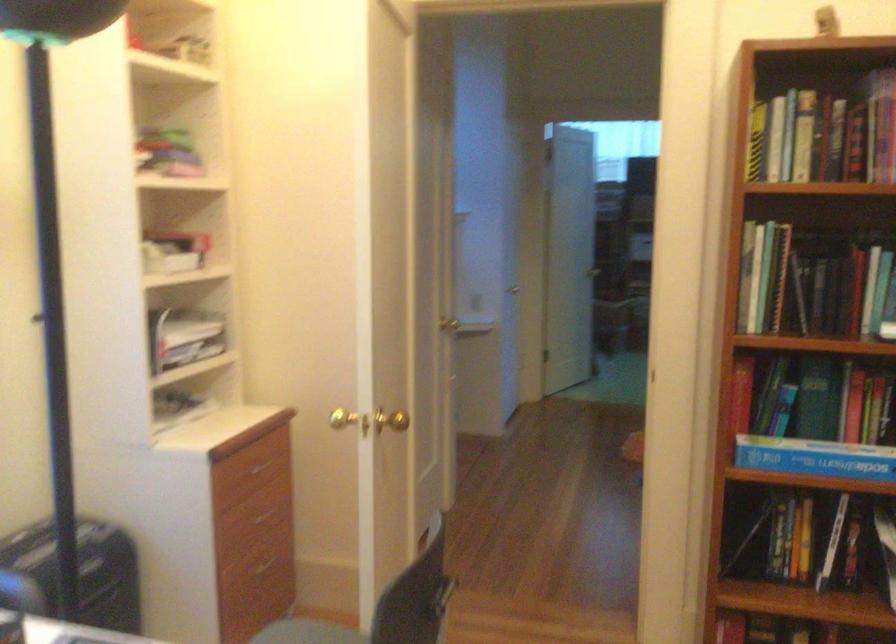
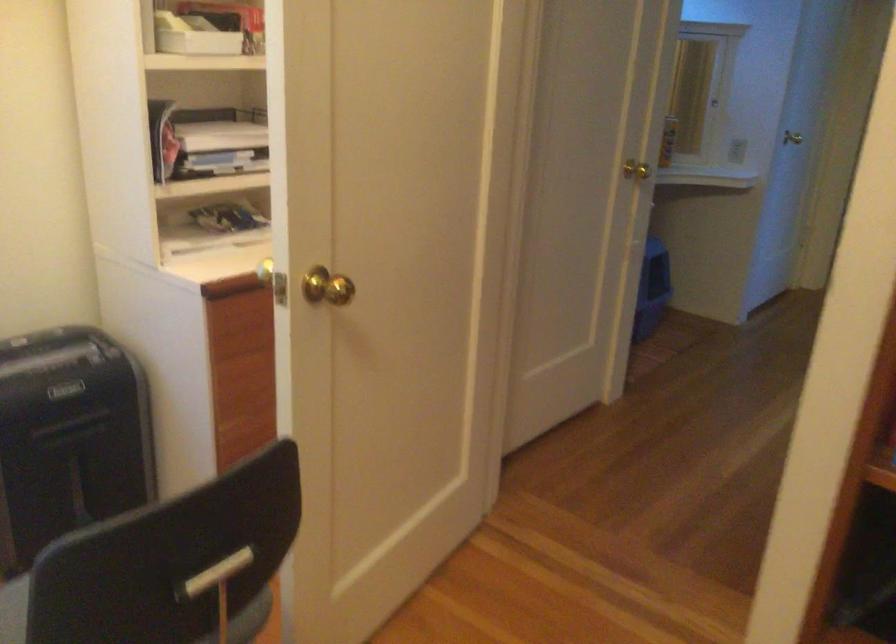
Based on the photo, in a continuous first-person perspective shot, in which direction is the camera moving?

The movement direction of the cameraman is right, forward.